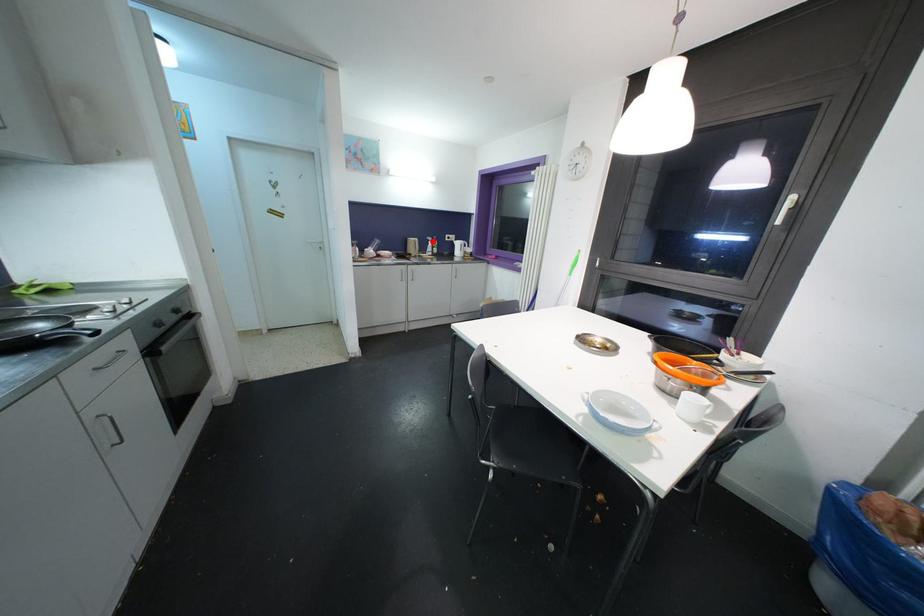
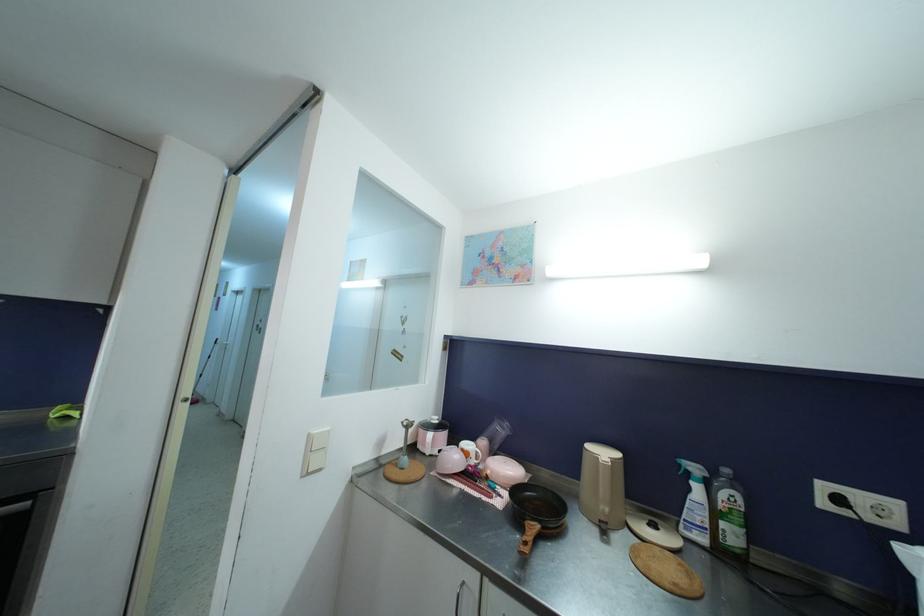
Question: I am providing you with two images of the same scene from different viewpoints. A red point is shown in image1. For the corresponding object point in image2, is it positioned nearer or farther from the camera?

Choices:
 (A) Nearer
 (B) Farther

Answer: (B)